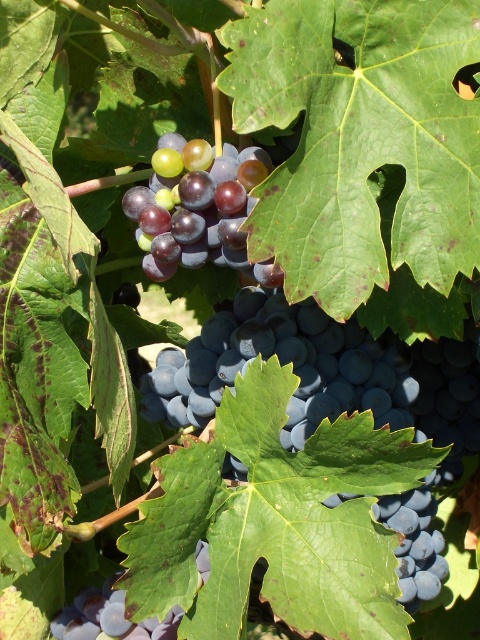
You are an artist painting a still life of the shiny dark blue grapes at center and the shiny purple grapes at center. Which cluster of grapes should you paint higher on your canvas to accurately represent their positions?

The shiny dark blue grapes at center should be painted higher on the canvas because they are taller than the shiny purple grapes at center.